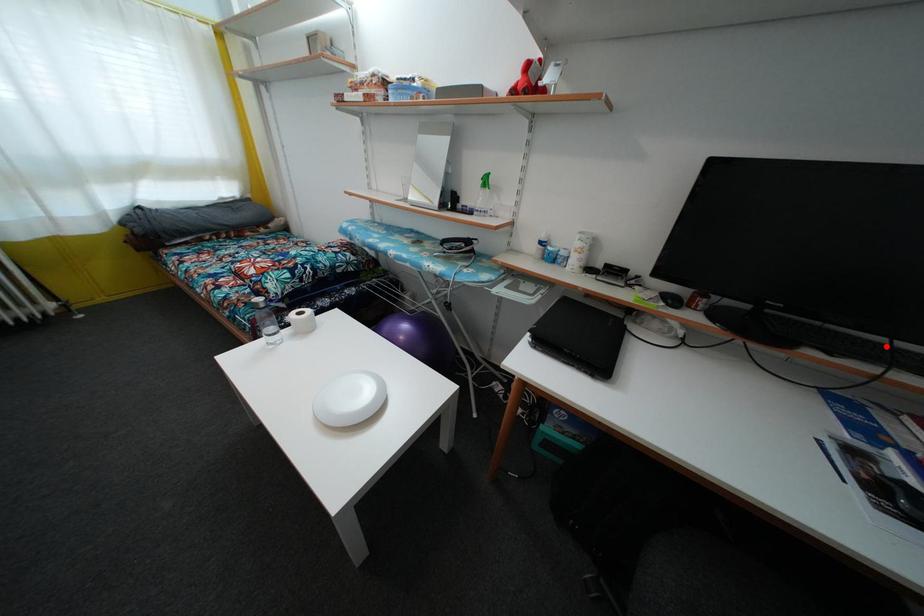
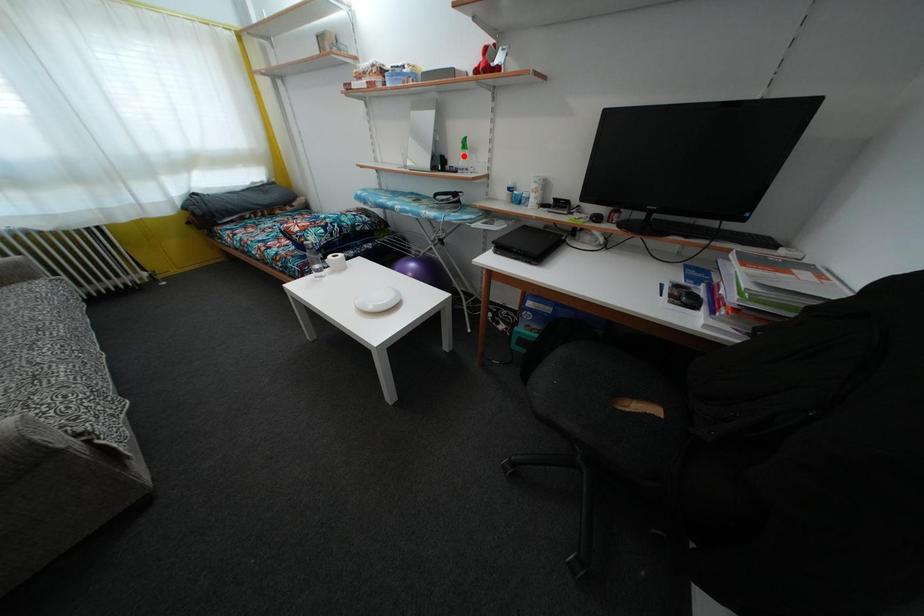
I am providing you with two images of the same scene from different viewpoints. A red point is marked on the first image and another point is marked on the second image. Is the marked point in image1 the same physical position as the marked point in image2?

No